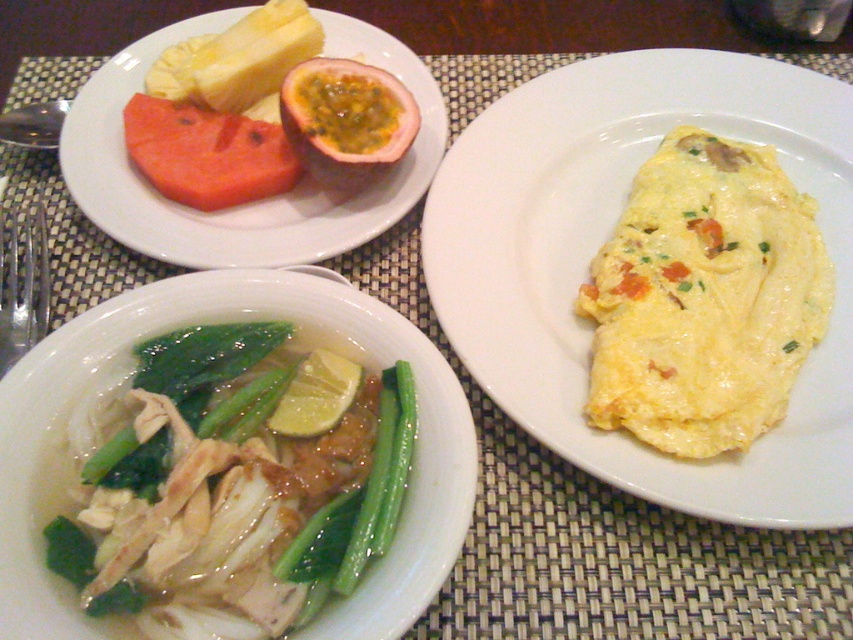
Between green leafy vegetables at lower left and passionfruitseedy fleshfruit at upper center, which one appears on the right side from the viewer's perspective?

Positioned to the right is passionfruitseedy fleshfruit at upper center.

Who is lower down, green leafy vegetables at lower left or passionfruitseedy fleshfruit at upper center?

green leafy vegetables at lower left is below.

At what (x,y) coordinates should I click in order to perform the action: click on green leafy vegetables at lower left. Please return your answer as a coordinate pair (x, y). This screenshot has height=640, width=853. Looking at the image, I should click on (238, 484).

Who is higher up, green leafy vegetables at lower left or silver metallic fork at left?

silver metallic fork at left is higher up.

Who is more forward, (221, 451) or (12, 342)?

Point (221, 451) is more forward.

Between point (213, 403) and point (35, 252), which one is positioned behind?

Point (35, 252)

Where is `green leafy vegetables at lower left`? green leafy vegetables at lower left is located at coordinates (238, 484).

Is point (172, 120) in front of point (28, 321)?

No, it is behind (28, 321).

Is red matte watermelon at upper left wider than silver metallic fork at left?

Yes.

Identify the location of red matte watermelon at upper left. Image resolution: width=853 pixels, height=640 pixels. (207, 154).